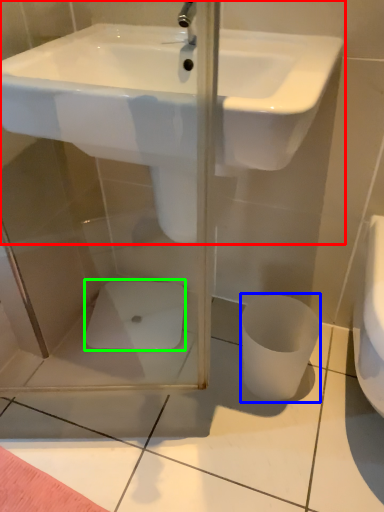
Question: Which is nearer to the sink (highlighted by a red box)? toilet bowl (highlighted by a blue box) or porcelain (highlighted by a green box).

Choices:
 (A) toilet bowl
 (B) porcelain

Answer: (A)